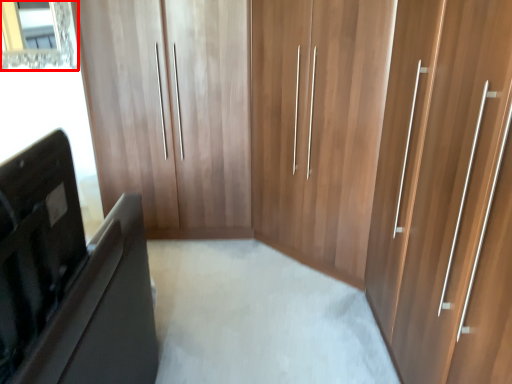
Question: From the image, what is the correct spatial relationship of mirror (annotated by the red box) in relation to furniture?

Choices:
 (A) left
 (B) right

Answer: (A)